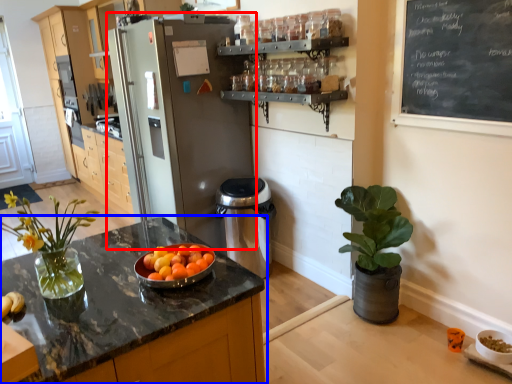
Question: Among these objects, which one is farthest to the camera, refrigerator (highlighted by a red box) or countertop (highlighted by a blue box)?

Choices:
 (A) refrigerator
 (B) countertop

Answer: (A)